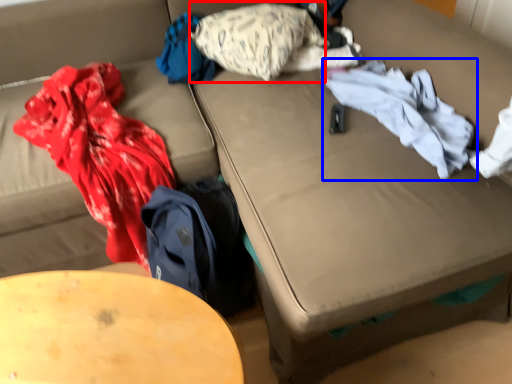
Question: Which object appears farthest to the camera in this image, pillow (highlighted by a red box) or clothing (highlighted by a blue box)?

Choices:
 (A) pillow
 (B) clothing

Answer: (A)